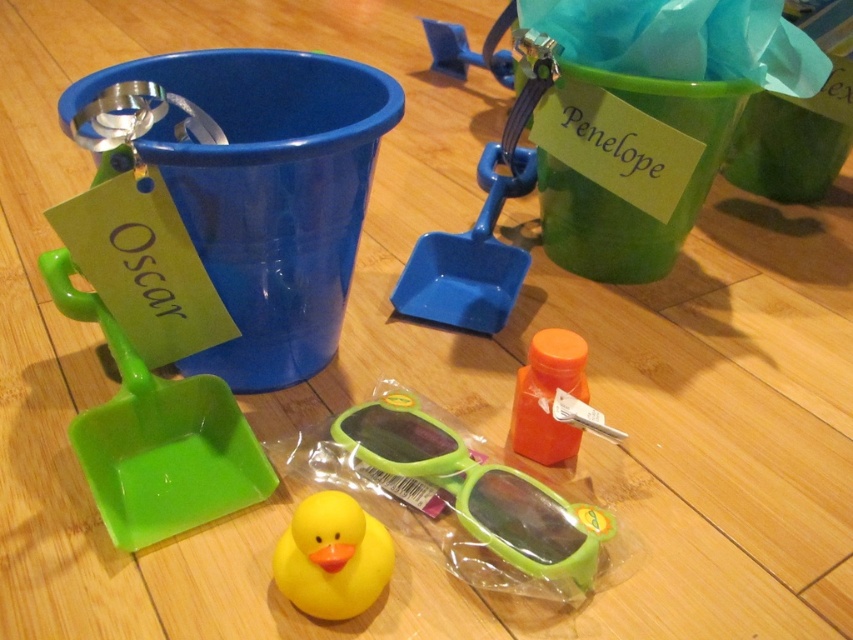
Does rubber duck at center have a lesser width compared to orange matte bottle at center?

In fact, rubber duck at center might be wider than orange matte bottle at center.

Does rubber duck at center appear on the left side of orange matte bottle at center?

Correct, you'll find rubber duck at center to the left of orange matte bottle at center.

You are a GUI agent. You are given a task and a screenshot of the screen. Output one action in this format:
    pyautogui.click(x=<x>, y=<y>)
    Task: Click on the rubber duck at center
    
    Given the screenshot: What is the action you would take?
    pyautogui.click(x=332, y=557)

Is point (453, 460) positioned behind point (285, 548)?

Yes.

Consider the image. Is green plastic goggles at center thinner than rubber duck at center?

No.

Who is more forward, (482, 490) or (328, 554)?

Point (328, 554)

Locate an element on the screen. The height and width of the screenshot is (640, 853). green plastic goggles at center is located at coordinates (477, 490).

What do you see at coordinates (477, 490) in the screenshot? I see `green plastic goggles at center` at bounding box center [477, 490].

Can you confirm if green plastic goggles at center is shorter than blue plastic shovel at center?

Indeed, green plastic goggles at center has a lesser height compared to blue plastic shovel at center.

Does point (503, 532) come farther from viewer compared to point (480, 166)?

No, it is not.

Where is `green plastic goggles at center`? This screenshot has height=640, width=853. green plastic goggles at center is located at coordinates (477, 490).